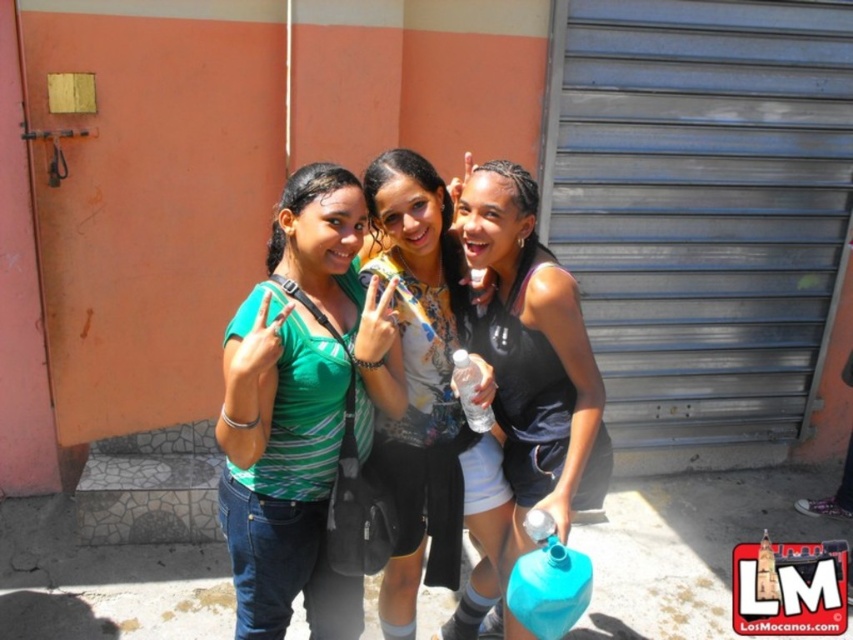
Looking at the three people in the scene, which one is wearing the green striped shirt at center and positioned to the left of the printed fabric shirt at center?

The green striped shirt at center is to the left of the printed fabric shirt at center.

You are trying to decide which of the two shirts, the green striped shirt at center or the printed fabric shirt at center, would be more suitable for a casual beach day. Based on the image, which one appears to be roomier and more comfortable?

The green striped shirt at center might be wider than printed fabric shirt at center, so it could be more comfortable for a casual beach day due to its looser fit.

You are a photographer taking a picture of the three people in the scene. You want to focus on the green striped shirt at center. Where should you aim your camera? Please provide coordinates in the format of point coordinates like point (300, 406).

You should aim your camera at point (300, 406), which is on the green striped shirt at center.